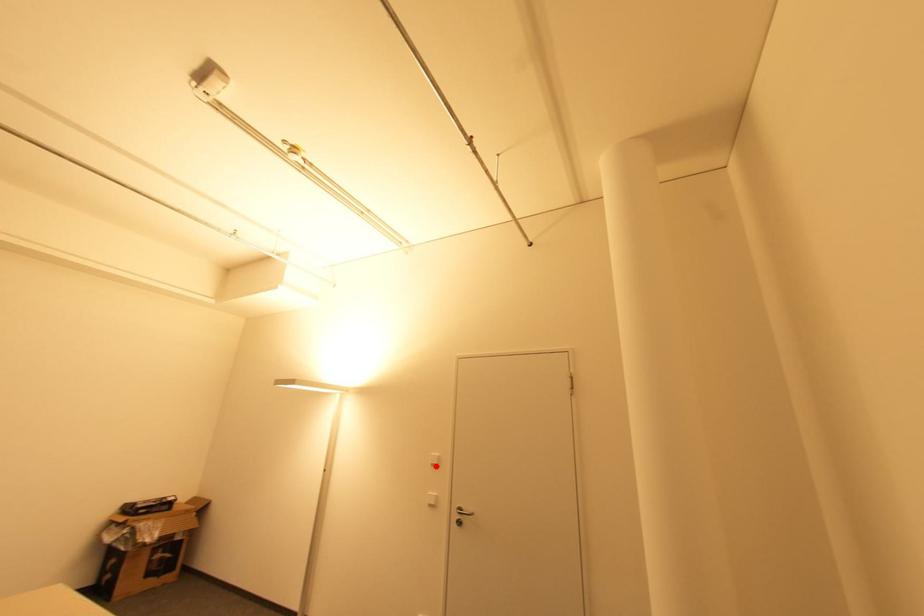
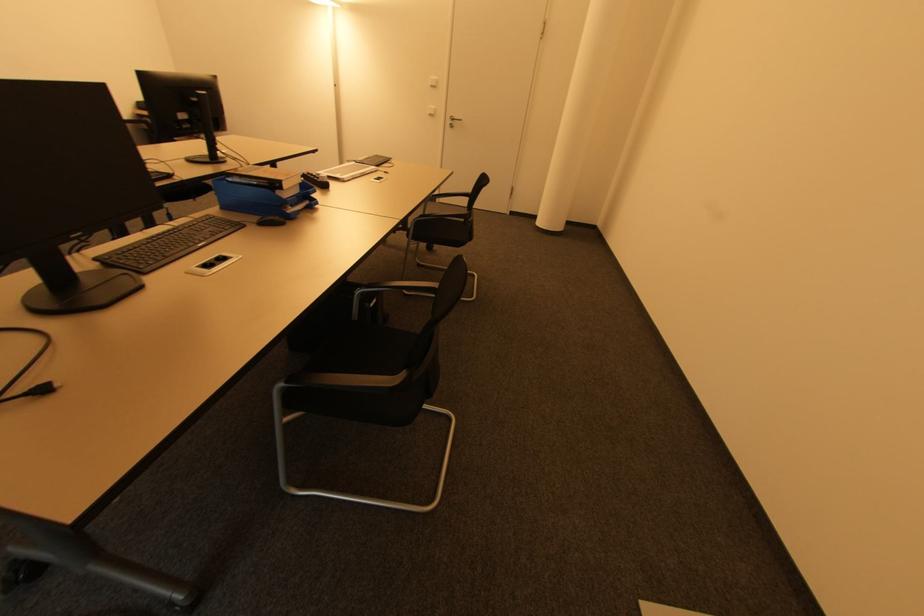
Question: I am providing you with two images of the same scene from different viewpoints. A red point is marked on the first image. At the location where the point appears in image 1, is it still visible in image 2?

Choices:
 (A) Yes
 (B) No

Answer: (A)